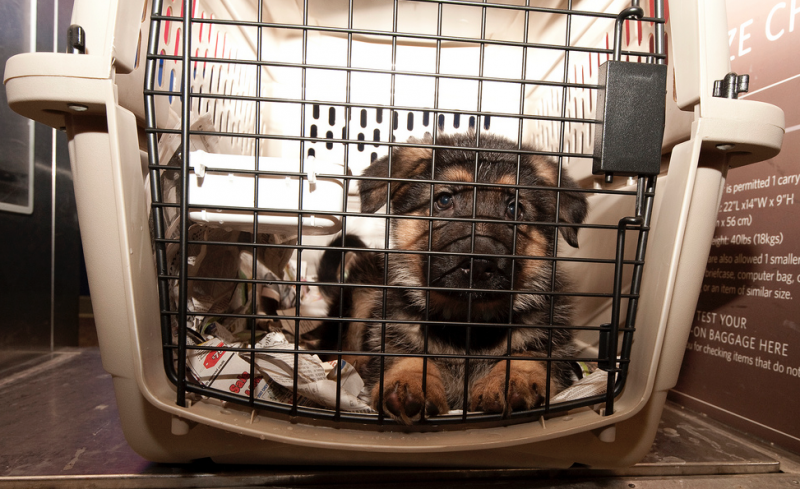
Locate an element on the screen. Image resolution: width=800 pixels, height=489 pixels. locker is located at coordinates (633, 110).